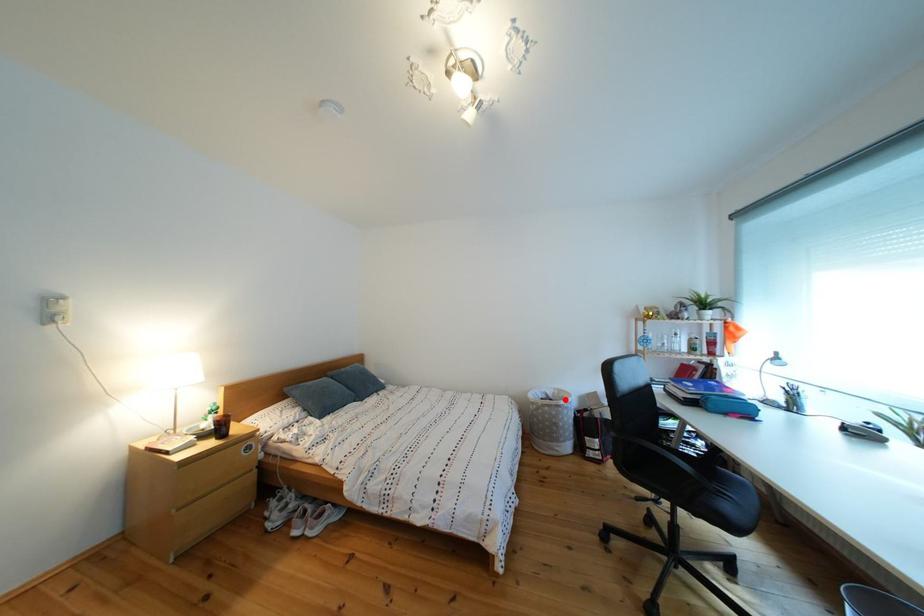
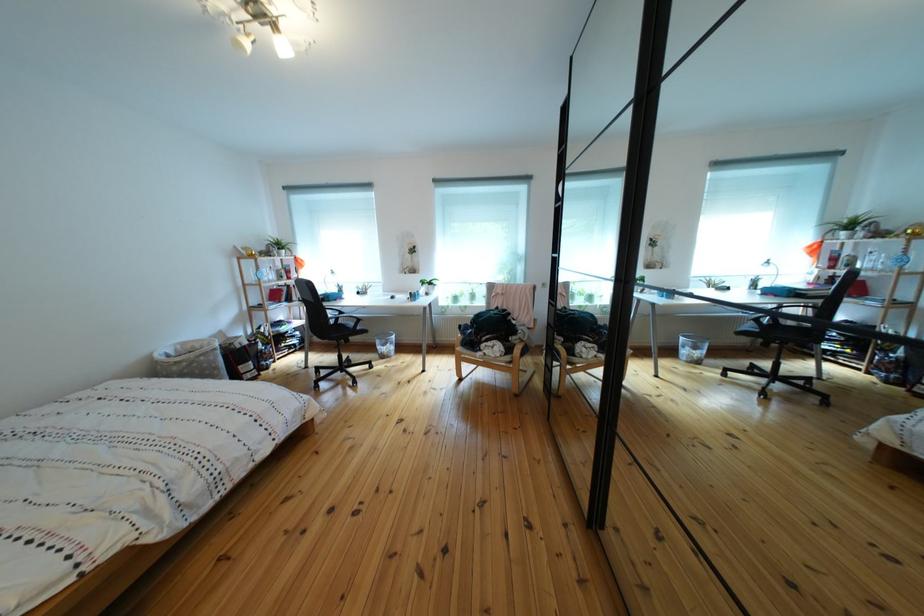
Locate, in the second image, the point that corresponds to the highlighted location in the first image.

(187, 355)